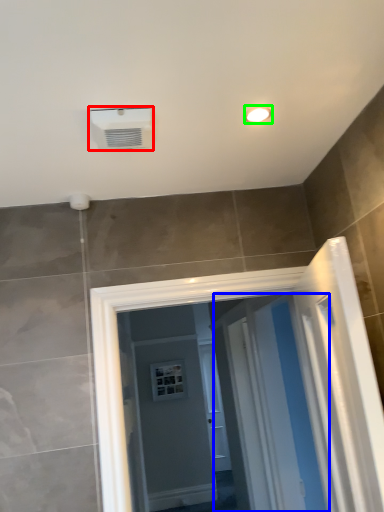
Question: Which object is positioned closest to air conditioning (highlighted by a red box)? Select from screen door (highlighted by a blue box) and light fixture (highlighted by a green box).

Choices:
 (A) screen door
 (B) light fixture

Answer: (B)